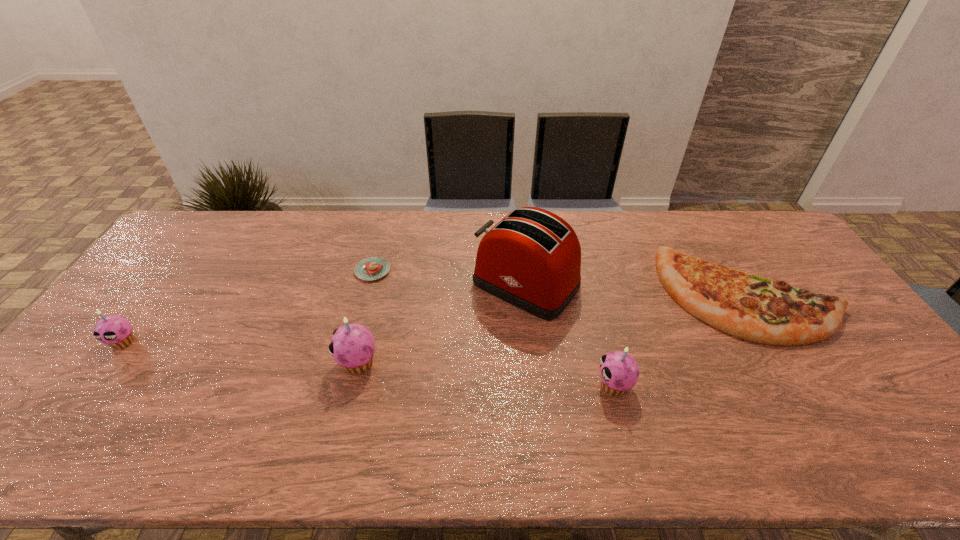
This screenshot has width=960, height=540. I want to click on vacant space that is in between the toaster and the second cupcake from right to left, so click(443, 323).

This screenshot has width=960, height=540. In order to click on empty space that is in between the rightmost cupcake and the pizza in this screenshot , I will do `click(681, 340)`.

You are a GUI agent. You are given a task and a screenshot of the screen. Output one action in this format:
    pyautogui.click(x=<x>, y=<y>)
    Task: Click on the free space between the third tallest object and the toaster
    This screenshot has width=960, height=540.
    Given the screenshot: What is the action you would take?
    pyautogui.click(x=570, y=335)

Find the location of a particular element. This screenshot has width=960, height=540. unoccupied position between the third tallest object and the second cupcake from right to left is located at coordinates (486, 374).

Locate an element on the screen. free space between the tallest object and the shortest object is located at coordinates (449, 278).

Find the location of a particular element. Image resolution: width=960 pixels, height=540 pixels. vacant region between the second cupcake from left to right and the fifth tallest object is located at coordinates (553, 329).

This screenshot has width=960, height=540. Find the location of `object that stands as the fourth closest to the third tallest object`. object that stands as the fourth closest to the third tallest object is located at coordinates (372, 268).

Point out which object is positioned as the second nearest to the second shortest object. Please provide its 2D coordinates. Your answer should be formatted as a tuple, i.e. [(x, y)], where the tuple contains the x and y coordinates of a point satisfying the conditions above.

[(531, 259)]

Locate an element on the screen. cupcake that can be found as the closest to the shortest object is located at coordinates (352, 346).

What are the coordinates of `cupcake that is the closest to the second cupcake from left to right` in the screenshot? It's located at (619, 371).